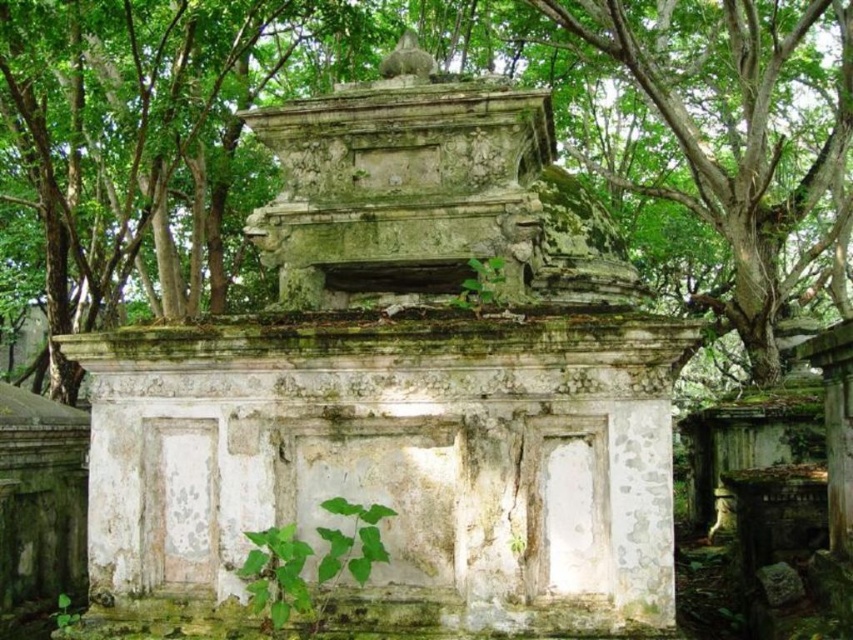
Can you confirm if green leafy tree at upper right is shorter than green leafy plant at lower center?

Indeed, green leafy tree at upper right has a lesser height compared to green leafy plant at lower center.

Is green leafy tree at upper right wider than green leafy plant at lower center?

No.

Measure the distance between green leafy tree at upper right and camera.

The distance of green leafy tree at upper right from camera is 42.00 feet.

Where is `green leafy tree at upper right`? green leafy tree at upper right is located at coordinates (737, 157).